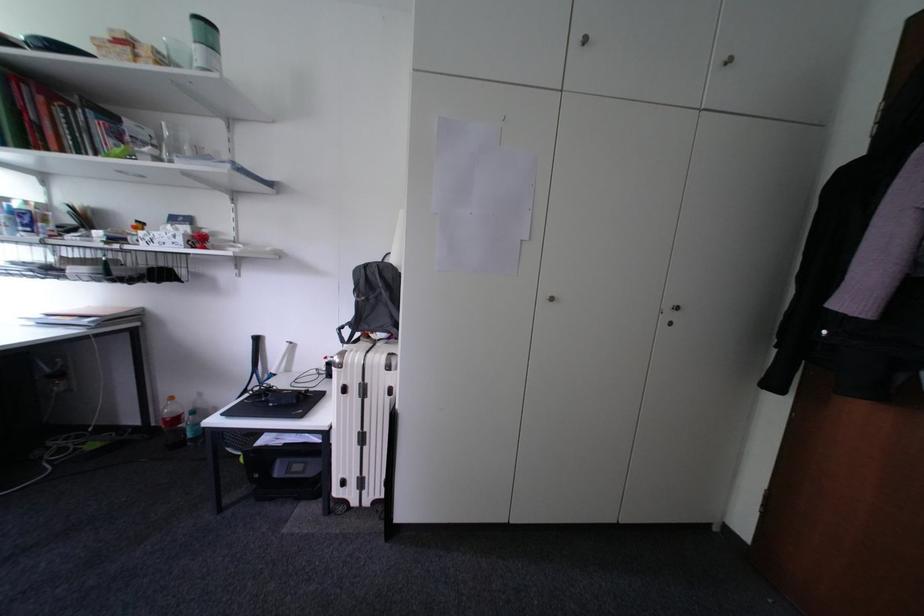
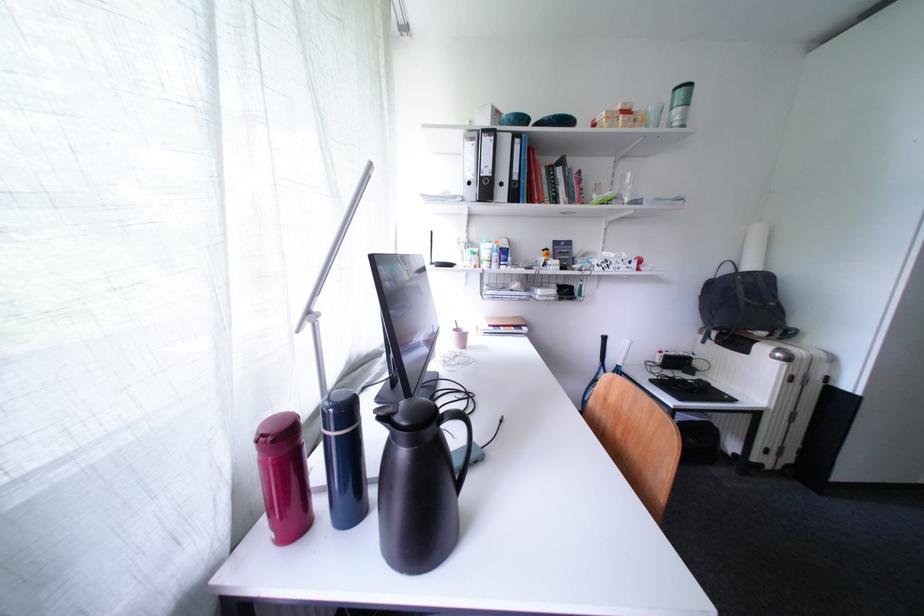
Question: Which direction would the cameraman need to move to produce the second image? Reply with the corresponding letter.

Choices:
 (A) Left
 (B) Right
 (C) Forward
 (D) Backward

Answer: (A)